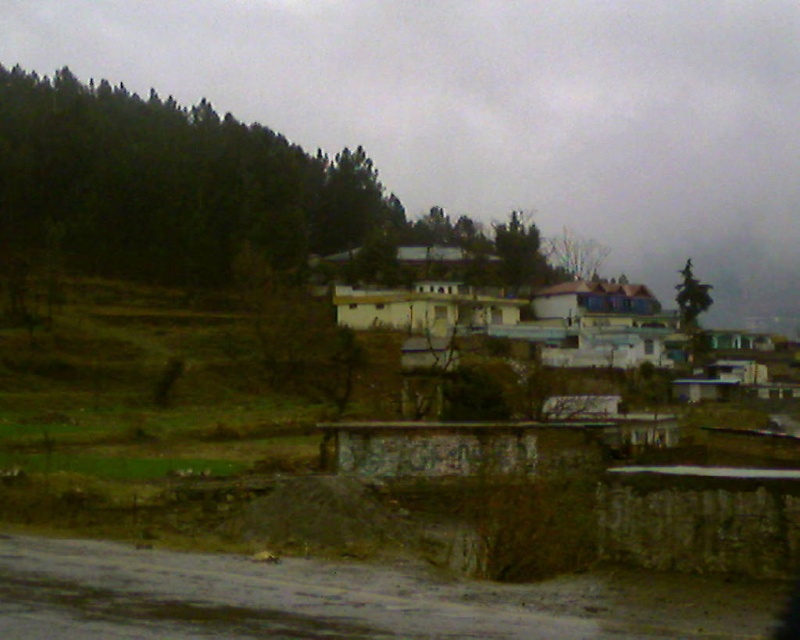
Question: Which point is closer to the camera?

Choices:
 (A) 536,230
 (B) 698,317

Answer: (B)

Question: Is green leafy trees at left below green matte tree at upper center?

Choices:
 (A) yes
 (B) no

Answer: (B)

Question: Is green leafy trees at left to the left of green leafy tree at upper right from the viewer's perspective?

Choices:
 (A) no
 (B) yes

Answer: (B)

Question: Which is nearer to the green matte tree at upper center?

Choices:
 (A) green leafy tree at upper right
 (B) green leafy trees at left

Answer: (A)

Question: Where is green leafy trees at left located in relation to green matte tree at upper center in the image?

Choices:
 (A) below
 (B) above

Answer: (B)

Question: Which point is farther to the camera?

Choices:
 (A) green matte tree at upper center
 (B) green leafy tree at upper right
 (C) green leafy trees at left

Answer: (A)